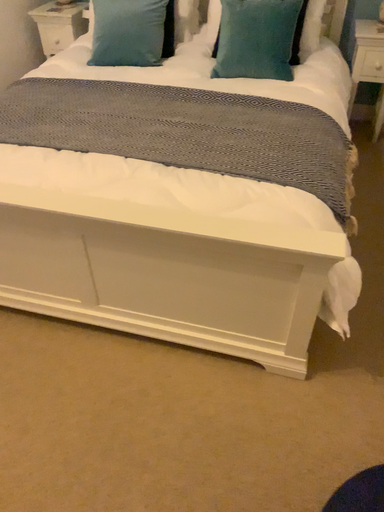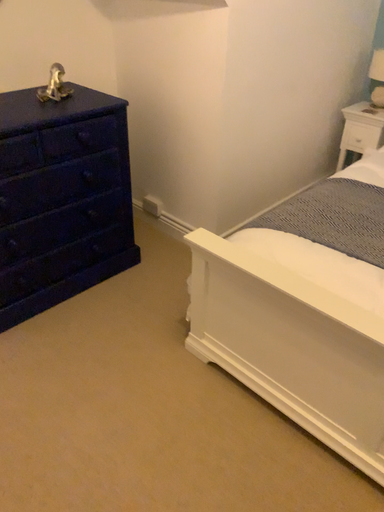
Question: Which way did the camera rotate in the video?

Choices:
 (A) rotated right
 (B) rotated left

Answer: (B)